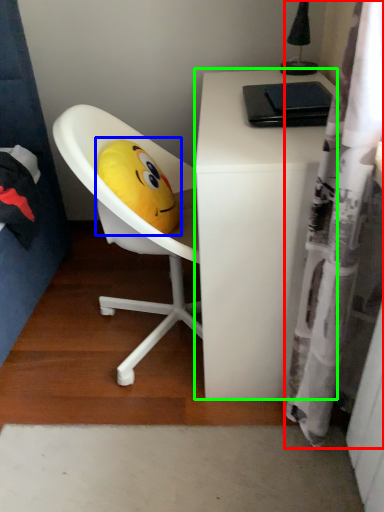
Question: Which object is the farthest from shower curtain (highlighted by a red box)? Choose among these: toy (highlighted by a blue box) or desk (highlighted by a green box).

Choices:
 (A) toy
 (B) desk

Answer: (A)